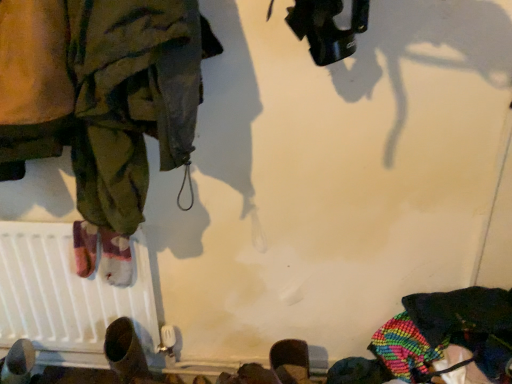
This screenshot has width=512, height=384. Identify the location of white matte radiator at lower left. (68, 296).

The image size is (512, 384). What are the coordinates of `camouflage fabric pants at left` in the screenshot? It's located at (115, 98).

Locate an element on the screen. This screenshot has height=384, width=512. brown leather shoe at lower left is located at coordinates (125, 352).

Who is taller, brown leather shoe at lower left or camouflage fabric pants at left?

Standing taller between the two is camouflage fabric pants at left.

Looking at this image, is brown leather shoe at lower left completely or partially outside of camouflage fabric pants at left?

Yes, brown leather shoe at lower left is located beyond the bounds of camouflage fabric pants at left.

Is brown leather shoe at lower left facing away from camouflage fabric pants at left?

brown leather shoe at lower left does not have its back to camouflage fabric pants at left.

Considering the relative positions of brown leather shoe at lower left and camouflage fabric pants at left in the image provided, is brown leather shoe at lower left behind camouflage fabric pants at left?

Yes, it is behind camouflage fabric pants at left.

From a real-world perspective, which is physically below, white matte radiator at lower left or brown leather shoe at lower left?

brown leather shoe at lower left.

Is white matte radiator at lower left next to brown leather shoe at lower left and touching it?

No, white matte radiator at lower left is not next to brown leather shoe at lower left.

Can you tell me how much white matte radiator at lower left and brown leather shoe at lower left differ in facing direction?

The facing directions of white matte radiator at lower left and brown leather shoe at lower left are 10.5 degrees apart.

Can you confirm if white matte radiator at lower left is taller than brown leather shoe at lower left?

Indeed, white matte radiator at lower left has a greater height compared to brown leather shoe at lower left.

Would you say camouflage fabric pants at left is a long distance from white matte radiator at lower left?

No, camouflage fabric pants at left is not far away from white matte radiator at lower left.

Can you tell me how much camouflage fabric pants at left and white matte radiator at lower left differ in facing direction?

0.000741 degrees separate the facing orientations of camouflage fabric pants at left and white matte radiator at lower left.

Looking at this image, considering the sizes of objects camouflage fabric pants at left and white matte radiator at lower left in the image provided, who is wider, camouflage fabric pants at left or white matte radiator at lower left?

With larger width is camouflage fabric pants at left.

Considering the positions of objects brown leather shoe at lower left and white matte radiator at lower left in the image provided, who is in front, brown leather shoe at lower left or white matte radiator at lower left?

brown leather shoe at lower left is more forward.

Can you tell me how much brown leather shoe at lower left and white matte radiator at lower left differ in facing direction?

10.5 degrees separate the facing orientations of brown leather shoe at lower left and white matte radiator at lower left.

Who is taller, brown leather shoe at lower left or white matte radiator at lower left?

Standing taller between the two is white matte radiator at lower left.

Considering the points (118, 334) and (56, 269), which point is in front, point (118, 334) or point (56, 269)?

Positioned in front is point (118, 334).

Is camouflage fabric pants at left facing towards brown leather shoe at lower left?

No, camouflage fabric pants at left is not aimed at brown leather shoe at lower left.

Considering the relative sizes of camouflage fabric pants at left and brown leather shoe at lower left in the image provided, is camouflage fabric pants at left taller than brown leather shoe at lower left?

Yes, camouflage fabric pants at left is taller than brown leather shoe at lower left.

Is camouflage fabric pants at left far from brown leather shoe at lower left?

camouflage fabric pants at left is near brown leather shoe at lower left, not far away.

Can you tell me how much camouflage fabric pants at left and brown leather shoe at lower left differ in facing direction?

10.5 degrees separate the facing orientations of camouflage fabric pants at left and brown leather shoe at lower left.

You are a GUI agent. You are given a task and a screenshot of the screen. Output one action in this format:
    pyautogui.click(x=<x>, y=<y>)
    Task: Click on the radiator below the camouflage fabric pants at left (from the image's perspective)
    This screenshot has width=512, height=384.
    Given the screenshot: What is the action you would take?
    68,296

Is the depth of white matte radiator at lower left less than that of camouflage fabric pants at left?

No, white matte radiator at lower left is behind camouflage fabric pants at left.

Is white matte radiator at lower left inside or outside of camouflage fabric pants at left?

white matte radiator at lower left cannot be found inside camouflage fabric pants at left.

Based on the photo, from the image's perspective, is white matte radiator at lower left located beneath camouflage fabric pants at left?

Yes, from the image's perspective, white matte radiator at lower left is below camouflage fabric pants at left.

I want to click on footwear below the camouflage fabric pants at left (from a real-world perspective), so click(x=125, y=352).

This screenshot has height=384, width=512. Find the location of `radiator located on the left of brown leather shoe at lower left`. radiator located on the left of brown leather shoe at lower left is located at coordinates (68, 296).

Looking at the image, which one is located closer to white matte radiator at lower left, camouflage fabric pants at left or brown leather shoe at lower left?

brown leather shoe at lower left lies closer to white matte radiator at lower left than the other object.

Which object lies nearer to the anchor point camouflage fabric pants at left, brown leather shoe at lower left or white matte radiator at lower left?

white matte radiator at lower left lies closer to camouflage fabric pants at left than the other object.

Looking at the image, which one is located closer to brown leather shoe at lower left, camouflage fabric pants at left or white matte radiator at lower left?

white matte radiator at lower left is closer to brown leather shoe at lower left.

Looking at the image, which one is located closer to white matte radiator at lower left, brown leather shoe at lower left or camouflage fabric pants at left?

The object closer to white matte radiator at lower left is brown leather shoe at lower left.

When comparing their distances from brown leather shoe at lower left, does white matte radiator at lower left or camouflage fabric pants at left seem closer?

white matte radiator at lower left lies closer to brown leather shoe at lower left than the other object.

Looking at the image, which one is located further to camouflage fabric pants at left, white matte radiator at lower left or brown leather shoe at lower left?

brown leather shoe at lower left is further to camouflage fabric pants at left.

Locate an element on the screen. This screenshot has height=384, width=512. radiator between camouflage fabric pants at left and brown leather shoe at lower left in the vertical direction is located at coordinates (68, 296).